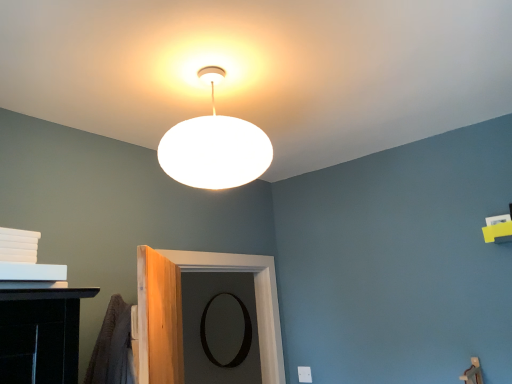
Question: Is white matte lampshade at upper center wider or thinner than black matte door at center?

Choices:
 (A) wide
 (B) thin

Answer: (A)

Question: Is white matte lampshade at upper center situated inside black matte door at center or outside?

Choices:
 (A) outside
 (B) inside

Answer: (A)

Question: Which is nearer to the white matte lampshade at upper center?

Choices:
 (A) black matte door at center
 (B) black matte mirror at center

Answer: (A)

Question: Considering the real-world distances, which object is farthest from the black matte mirror at center?

Choices:
 (A) black matte door at center
 (B) white matte lampshade at upper center

Answer: (B)